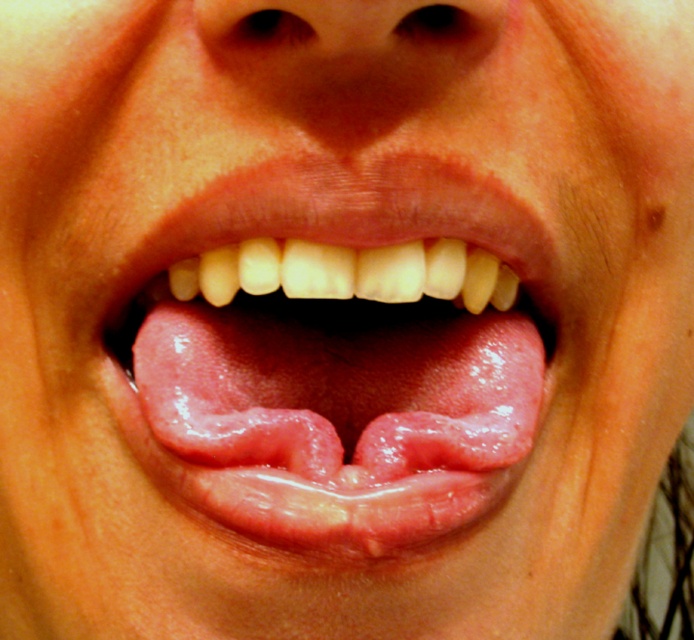
Question: Is pink flesh tongue at center bigger than smooth skin at center?

Choices:
 (A) no
 (B) yes

Answer: (B)

Question: In this image, where is pink flesh tongue at center located relative to smooth skin at center?

Choices:
 (A) below
 (B) above

Answer: (A)

Question: Is pink flesh tongue at center positioned in front of smooth skin at center?

Choices:
 (A) yes
 (B) no

Answer: (B)